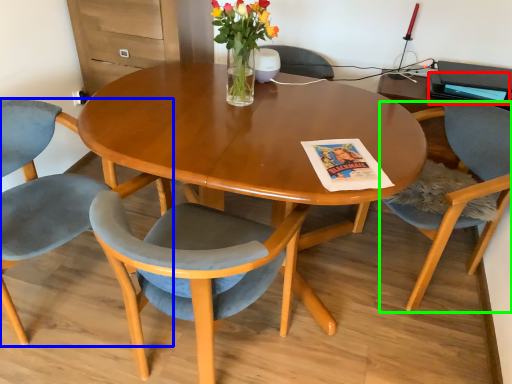
Question: Which object is the farthest from magazine (highlighted by a red box)? Choose among these: chair (highlighted by a blue box) or chair (highlighted by a green box).

Choices:
 (A) chair
 (B) chair

Answer: (A)